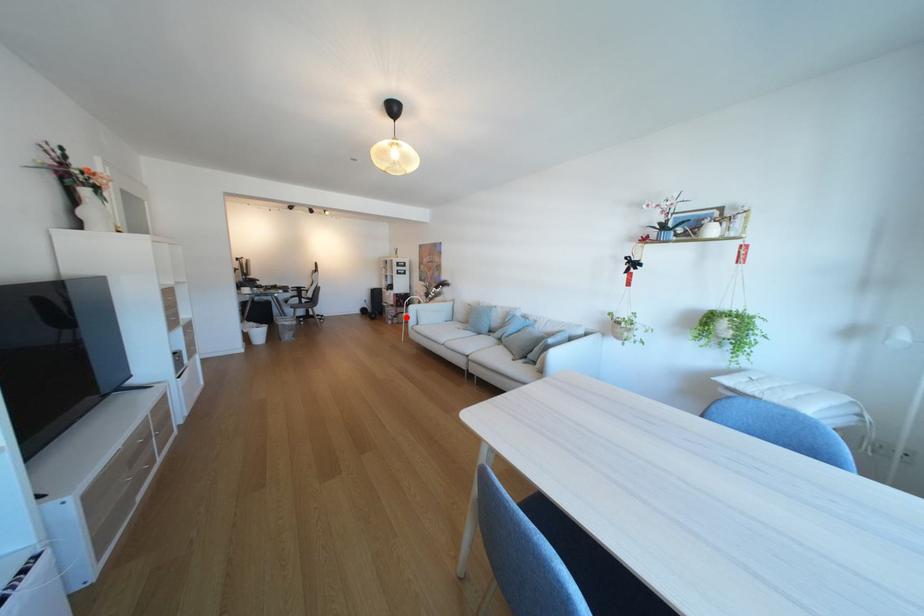
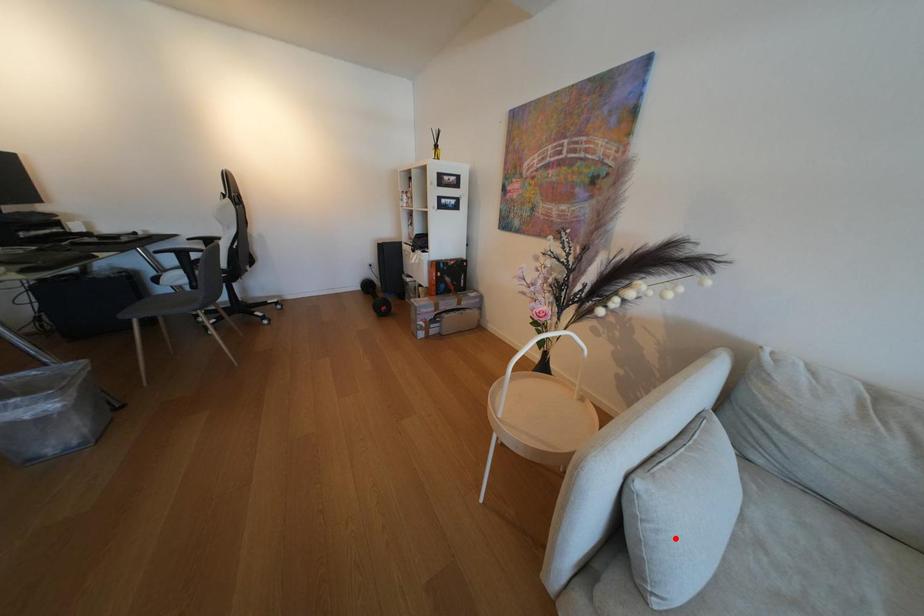
I am providing you with two images of the same scene from different viewpoints. A red point is marked on the first image and another point is marked on the second image. Do the highlighted points in image1 and image2 indicate the same real-world spot?

No